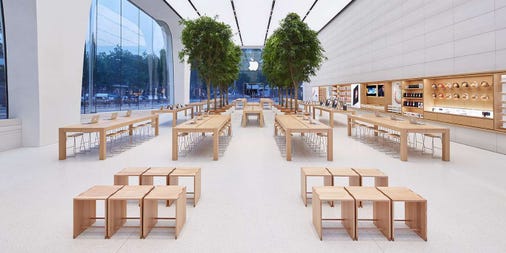
Identify the location of window. (140, 57).